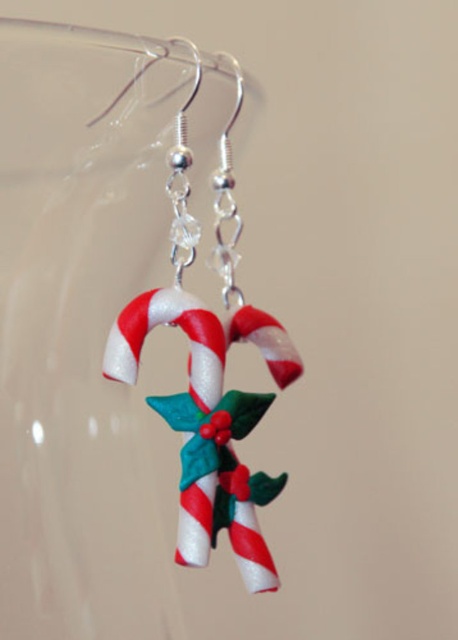
Question: Is the position of transparent glass vase at center less distant than that of shiny plastic candy cane at center?

Choices:
 (A) yes
 (B) no

Answer: (A)

Question: Which of the following is the farthest from the observer?

Choices:
 (A) shiny plastic candy cane at center
 (B) transparent glass vase at center

Answer: (A)

Question: Is transparent glass vase at center below shiny plastic candy cane at center?

Choices:
 (A) yes
 (B) no

Answer: (B)

Question: Is transparent glass vase at center to the right of shiny plastic candy cane at center from the viewer's perspective?

Choices:
 (A) no
 (B) yes

Answer: (A)